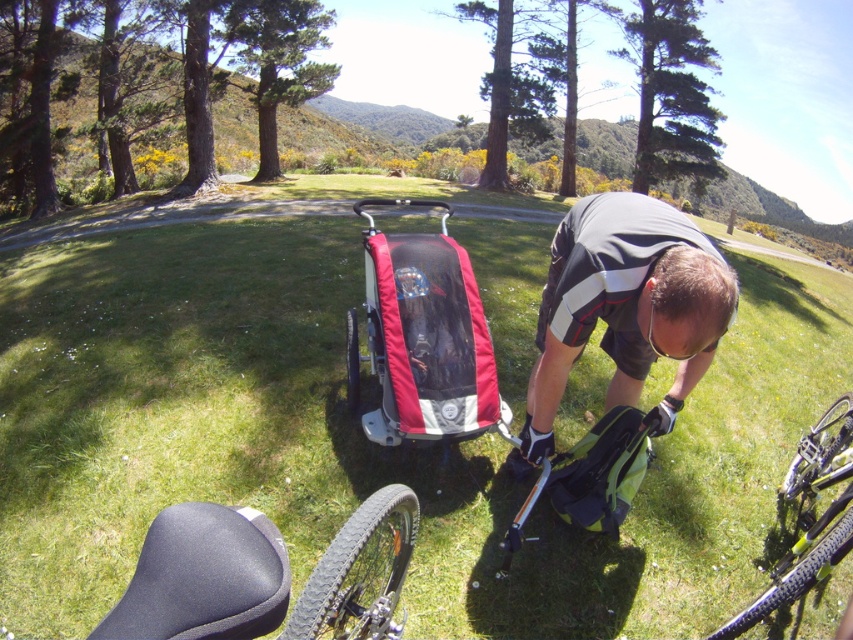
Question: Which object is the farthest from the green grass at center?

Choices:
 (A) red fabric baby carriage at center
 (B) dark gray fabric shirt at center

Answer: (A)

Question: Which of the following is the farthest from the observer?

Choices:
 (A) (834, 420)
 (B) (428, 257)
 (C) (807, 332)
 (D) (231, 586)

Answer: (C)

Question: From the image, what is the correct spatial relationship of green grass at center in relation to red fabric baby carriage at center?

Choices:
 (A) above
 (B) below

Answer: (A)

Question: Is green grass at center positioned behind red fabric baby carriage at center?

Choices:
 (A) no
 (B) yes

Answer: (A)

Question: From the image, what is the correct spatial relationship of dark gray fabric shirt at center in relation to black matte seat at lower left?

Choices:
 (A) below
 (B) above

Answer: (B)

Question: Which object is positioned closest to the dark gray fabric shirt at center?

Choices:
 (A) black matte seat at lower left
 (B) yellow matte bicycle at lower right
 (C) red fabric baby carriage at center
 (D) green grass at center

Answer: (C)